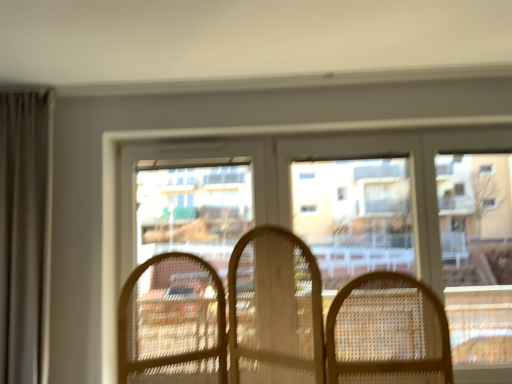
Question: Considering their positions, is translucent wicker chairs at center located in front of or behind clear plastic window screen at center?

Choices:
 (A) behind
 (B) front

Answer: (B)

Question: Is translucent wicker chairs at center taller or shorter than clear plastic window screen at center?

Choices:
 (A) tall
 (B) short

Answer: (B)

Question: Considering the real-world distances, which object is closest to the clear plastic window screen at center?

Choices:
 (A) clear plastic screen door at center
 (B) translucent wicker chairs at center

Answer: (B)

Question: Estimate the real-world distances between objects in this image. Which object is closer to the clear plastic screen door at center?

Choices:
 (A) clear plastic window screen at center
 (B) translucent wicker chairs at center

Answer: (B)